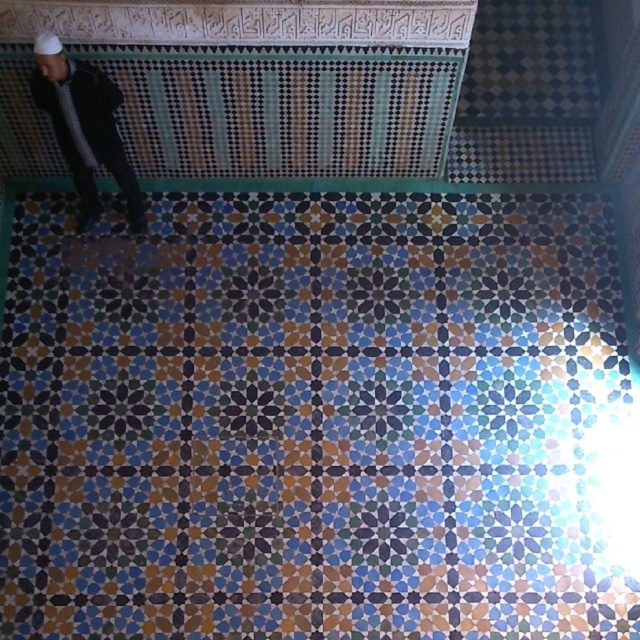
Is point (394, 467) positioned behind point (106, 136)?

Yes, point (394, 467) is behind point (106, 136).

Is mosaic tile at center shorter than dark gray jacket at left?

No.

Describe the element at coordinates (310, 419) in the screenshot. I see `mosaic tile at center` at that location.

This screenshot has width=640, height=640. Find the location of `mosaic tile at center`. mosaic tile at center is located at coordinates (310, 419).